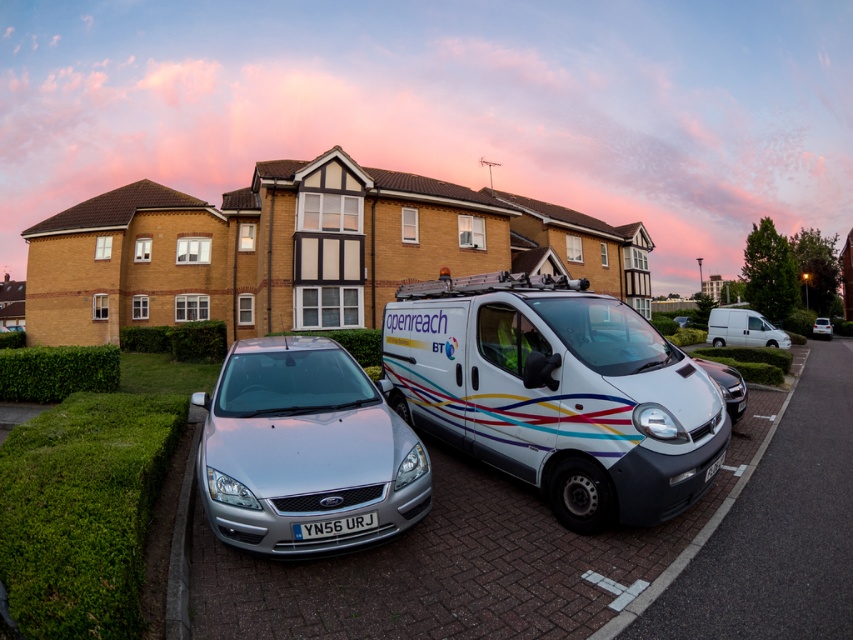
Which is more to the left, white matte van at center-right or white plastic license plate at center?

Positioned to the left is white plastic license plate at center.

Is white matte van at center-right bigger than white plastic license plate at center?

Indeed, white matte van at center-right has a larger size compared to white plastic license plate at center.

Is point (753, 326) positioned before point (717, 461)?

No, (753, 326) is behind (717, 461).

This screenshot has width=853, height=640. Find the location of `white matte van at center-right`. white matte van at center-right is located at coordinates (743, 330).

Which is more to the left, gray concrete curb at lower left or yellow metallic license plate at center?

gray concrete curb at lower left

Between gray concrete curb at lower left and yellow metallic license plate at center, which one has less height?

Answer: gray concrete curb at lower left

Does point (181, 522) lie behind point (316, 525)?

Yes, point (181, 522) is farther from viewer.

Where is `gray concrete curb at lower left`? gray concrete curb at lower left is located at coordinates (181, 550).

Based on the photo, which is more to the left, gray concrete curb at lower left or white matte van at center-right?

Positioned to the left is gray concrete curb at lower left.

Which is behind, point (186, 563) or point (741, 308)?

The point (741, 308) is behind.

Locate an element on the screen. This screenshot has height=640, width=853. gray concrete curb at lower left is located at coordinates (181, 550).